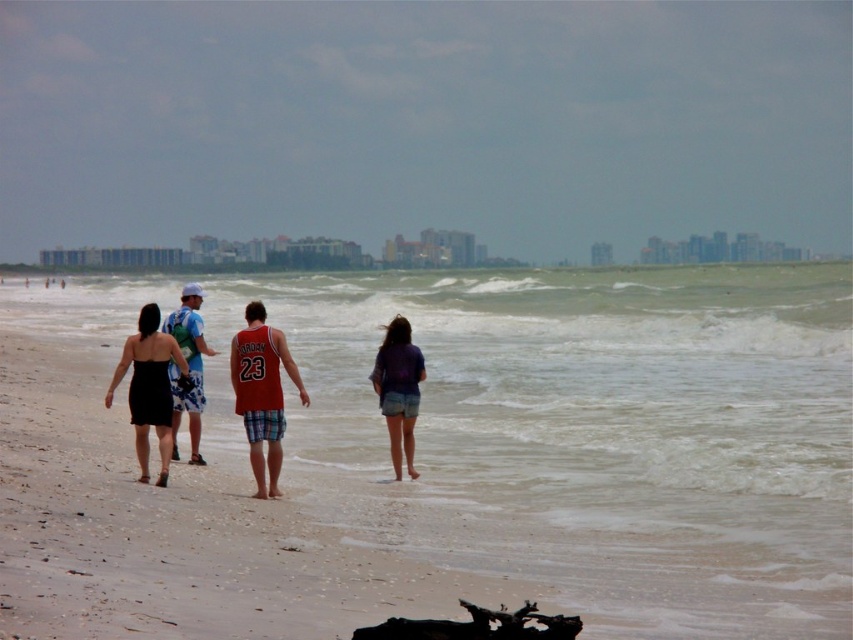
Does point (683, 320) come behind point (387, 374)?

That is True.

Is point (791, 417) positioned in front of point (407, 456)?

No.

Identify the location of greenish water at center. (592, 433).

Is red jersey at center closer to camera compared to white cap at center?

That is False.

Does red jersey at center have a smaller size compared to white cap at center?

Correct, red jersey at center occupies less space than white cap at center.

Who is more forward, (252,444) or (196,404)?

Point (252,444) is in front.

Image resolution: width=853 pixels, height=640 pixels. I want to click on red jersey at center, so click(x=161, y=372).

Does greenish water at center have a greater width compared to matte red jersey at center?

Yes, greenish water at center is wider than matte red jersey at center.

Does greenish water at center appear on the left side of matte red jersey at center?

Incorrect, greenish water at center is not on the left side of matte red jersey at center.

Where is `greenish water at center`? Image resolution: width=853 pixels, height=640 pixels. greenish water at center is located at coordinates (592, 433).